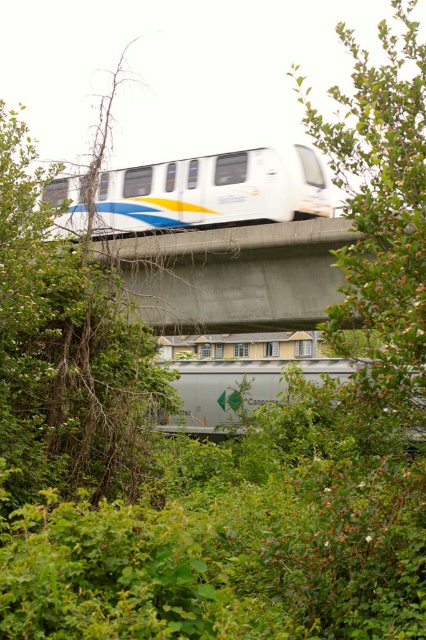
In the scene shown: You are standing on the monorail train and looking out the window. You see a point marked at coordinates (66, 349). Based on the scene, can you tell me what this point is located on?

The point (66, 349) is located on a green leafy tree at left.

You are a passenger on the white glossy monorail at center and want to take a photo of the green leafy tree at left. Can you clearly see the tree through the window? Explain why or why not based on their positions.

The green leafy tree at left is closer to the viewer than the white glossy monorail at center. Since the tree is closer, it will appear in focus, while the monorail itself is the subject at the center. However, as a passenger inside the monorail, your viewpoint is from within the train, so the tree would be outside and in the foreground. The tree being closer means it would be in focus, but parts of the monorail or its structure might obstruct the view. However, based on the description, the branches and le

You are a photographer trying to capture the white glossy monorail at center and the green leafy tree at upper right in a single frame. Based on their sizes in the image, which object would appear larger in your photo?

The green leafy tree at upper right appears larger in the photo because it is bigger than the white glossy monorail at center according to the description.